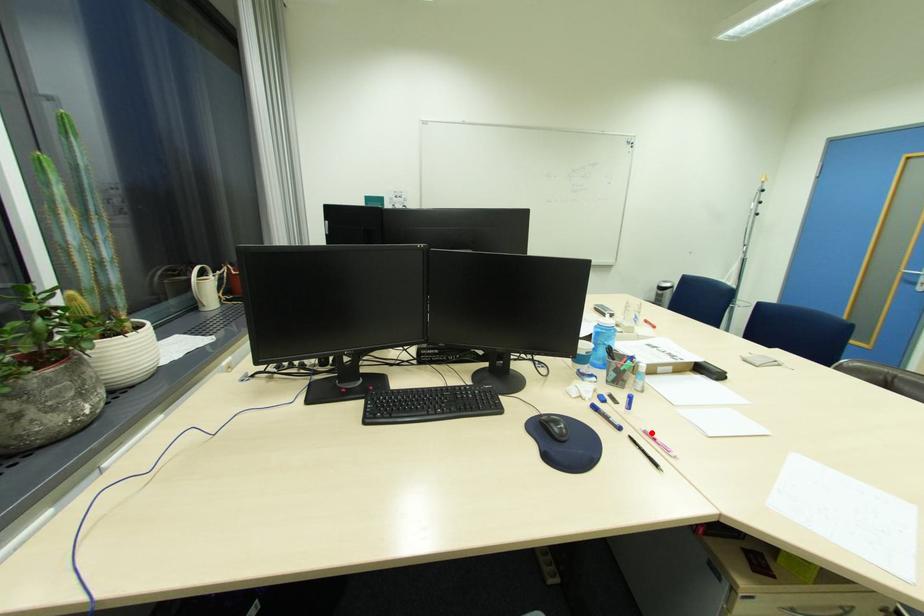
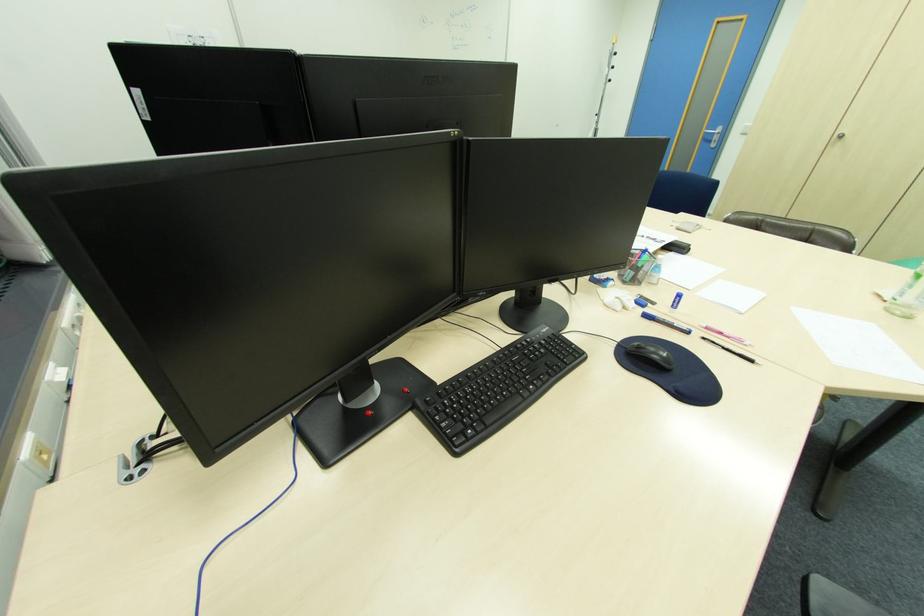
Where in the second image is the point corresponding to the highlighted location from the first image?

(712, 328)